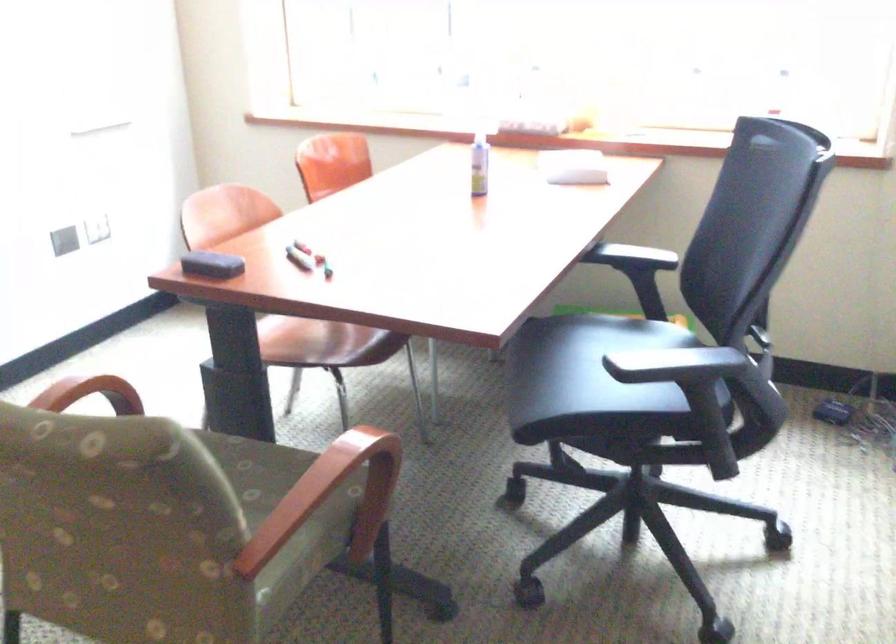
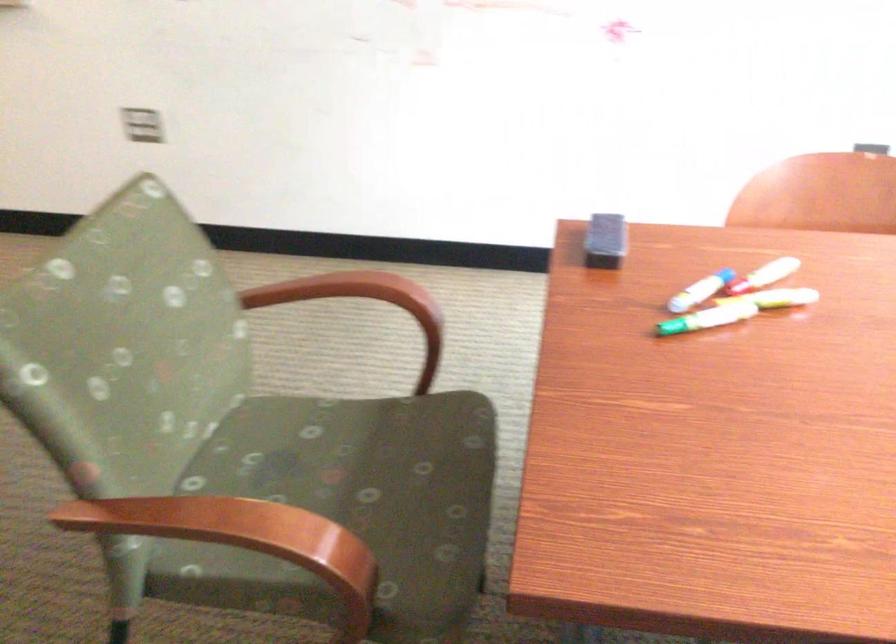
Locate, in the second image, the point that corresponds to (306,239) in the first image.

(773, 270)